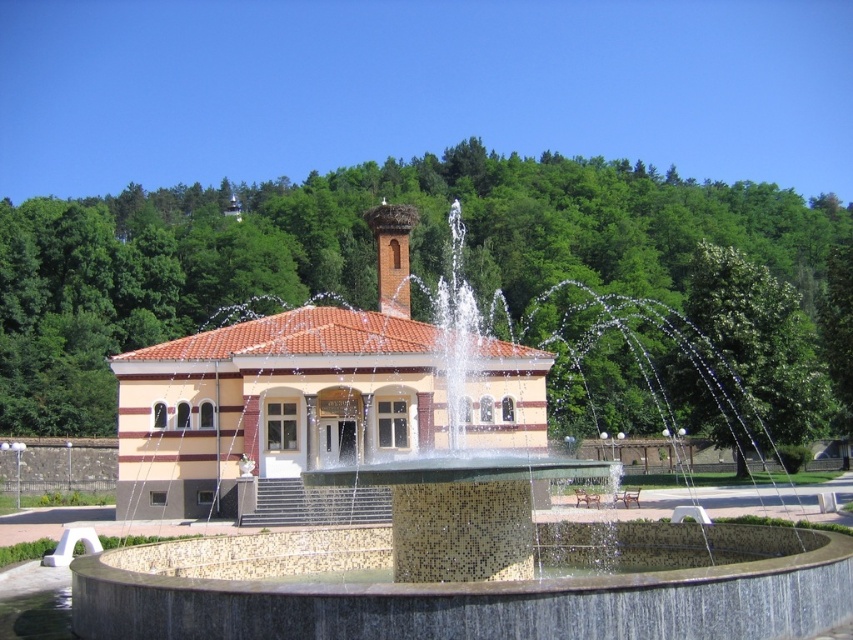
Is yellow brick building at center positioned at the back of brick chimney at center?

No, it is not.

Between yellow brick building at center and brick chimney at center, which one appears on the right side from the viewer's perspective?

brick chimney at center is more to the right.

Between point (318, 444) and point (364, 211), which one is positioned behind?

Positioned behind is point (364, 211).

Locate an element on the screen. yellow brick building at center is located at coordinates (271, 410).

Can you confirm if mosaic tiled fountain at center is positioned to the right of yellow brick building at center?

Indeed, mosaic tiled fountain at center is positioned on the right side of yellow brick building at center.

Between mosaic tiled fountain at center and yellow brick building at center, which one is positioned lower?

mosaic tiled fountain at center

Does point (521, 588) lie in front of point (502, 397)?

Yes.

You are a GUI agent. You are given a task and a screenshot of the screen. Output one action in this format:
    pyautogui.click(x=<x>, y=<y>)
    Task: Click on the mosaic tiled fountain at center
    This screenshot has width=853, height=640.
    Given the screenshot: What is the action you would take?
    pyautogui.click(x=418, y=506)

Is mosaic tiled fountain at center positioned behind brick chimney at center?

No, mosaic tiled fountain at center is in front of brick chimney at center.

Can you confirm if mosaic tiled fountain at center is wider than brick chimney at center?

Correct, the width of mosaic tiled fountain at center exceeds that of brick chimney at center.

Describe the element at coordinates (418, 506) in the screenshot. I see `mosaic tiled fountain at center` at that location.

At what (x,y) coordinates should I click in order to perform the action: click on mosaic tiled fountain at center. Please return your answer as a coordinate pair (x, y). Looking at the image, I should click on (418, 506).